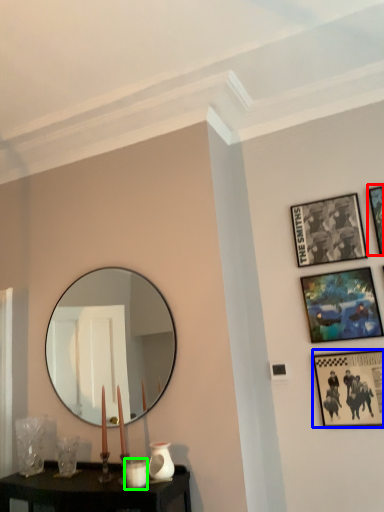
Question: Estimate the real-world distances between objects in this image. Which object is farther from picture frame (highlighted by a red box), picture frame (highlighted by a blue box) or candle holder (highlighted by a green box)?

Choices:
 (A) picture frame
 (B) candle holder

Answer: (B)